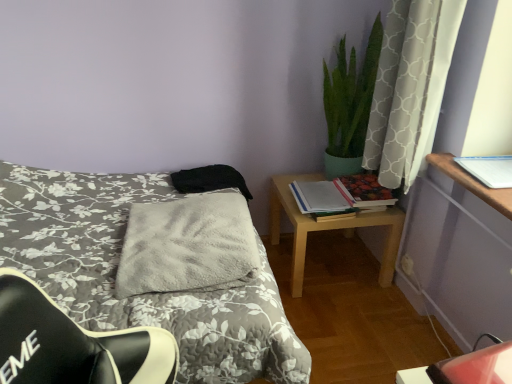
This screenshot has height=384, width=512. Identify the location of black fabric pillow at center. coord(209,180).

Identify the location of light wood/texture nightstand at right. (327, 228).

From a real-world perspective, between white textured curtain at upper right and white paper at upper right, arranged as the 1th book when viewed from the right, who is vertically lower?

white paper at upper right, arranged as the 1th book when viewed from the right, from a real-world perspective.

Identify the location of curtain that appears above the white paper at upper right, arranged as the 1th book when viewed from the right (from a real-world perspective). (410, 87).

Is white textured curtain at upper right facing towards white paper at upper right, which is the 1th book from front to back?

No.

Does white textured curtain at upper right appear on the right side of white paper at upper right, which is the 1th book from front to back?

In fact, white textured curtain at upper right is to the left of white paper at upper right, which is the 1th book from front to back.

Is hardcover book at right, positioned as the second book in left-to-right order, turned away from matte paper book at center right, positioned as the 3th book in right-to-left order?

That's not correct — hardcover book at right, positioned as the second book in left-to-right order, is not looking away from matte paper book at center right, positioned as the 3th book in right-to-left order.

From the image's perspective, between hardcover book at right, the first book in the back-to-front sequence, and matte paper book at center right, the second book in the back-to-front sequence, who is located below?

matte paper book at center right, the second book in the back-to-front sequence, is shown below in the image.

Who is shorter, hardcover book at right, which appears as the second book when viewed from the right, or matte paper book at center right, the second book in the back-to-front sequence?

Standing shorter between the two is matte paper book at center right, the second book in the back-to-front sequence.

Is matte paper book at center right, the 1th book when ordered from left to right, bigger or smaller than white paper at upper right, the 3th book positioned from the back?

Clearly, matte paper book at center right, the 1th book when ordered from left to right, is larger in size than white paper at upper right, the 3th book positioned from the back.

Which is correct: matte paper book at center right, the second book in the back-to-front sequence, is inside white paper at upper right, arranged as the 1th book when viewed from the right, or outside of it?

matte paper book at center right, the second book in the back-to-front sequence, lies outside white paper at upper right, arranged as the 1th book when viewed from the right.

Considering the relative sizes of matte paper book at center right, the second book from the front, and white paper at upper right, the 3th book positioned from the back, in the image provided, is matte paper book at center right, the second book from the front, wider than white paper at upper right, the 3th book positioned from the back,?

Yes.

Starting from the white paper at upper right, which is the 1th book from front to back, which book is the 2nd one to the left? Please provide its 2D coordinates.

[(318, 197)]

Considering the positions of objects black fabric pillow at center and fluffy gray blanket at center in the image provided, who is more to the right, black fabric pillow at center or fluffy gray blanket at center?

black fabric pillow at center is more to the right.

Who is taller, black fabric pillow at center or fluffy gray blanket at center?

fluffy gray blanket at center is taller.

Is black fabric pillow at center wider than fluffy gray blanket at center?

Incorrect, the width of black fabric pillow at center does not surpass that of fluffy gray blanket at center.

From the picture: From a real-world perspective, which object stands above the other?

black fabric pillow at center is physically above.

Who is more distant, black fabric pillow at center or matte paper book at center right, the second book in the back-to-front sequence?

black fabric pillow at center is behind.

Which is closer, [222,179] or [297,187]?

Point [222,179] is positioned closer to the camera compared to point [297,187].

Who is taller, black fabric pillow at center or matte paper book at center right, the second book from the front?

black fabric pillow at center is taller.

Is the depth of black fabric pillow at center greater than that of hardcover book at right, which appears as the second book when viewed from the right?

Yes, it is behind hardcover book at right, which appears as the second book when viewed from the right.

Between black fabric pillow at center and hardcover book at right, which appears as the second book when viewed from the right, which one appears on the left side from the viewer's perspective?

Positioned to the left is black fabric pillow at center.

Does black fabric pillow at center have a larger size compared to hardcover book at right, which appears as the second book when viewed from the right?

Yes, black fabric pillow at center is bigger than hardcover book at right, which appears as the second book when viewed from the right.

Is hardcover book at right, the first book in the back-to-front sequence, inside black fabric pillow at center?

No, hardcover book at right, the first book in the back-to-front sequence, is located outside of black fabric pillow at center.

Does point (192, 266) come farther from viewer compared to point (204, 183)?

No, it is not.

From the image's perspective, which one is positioned higher, gray fluffy blanket at center or black fabric pillow at center?

From the image's view, black fabric pillow at center is above.

Is black fabric pillow at center at the back of gray fluffy blanket at center?

gray fluffy blanket at center is not turned away from black fabric pillow at center.

Is gray fluffy blanket at center positioned in front of black fabric pillow at center?

Yes, it is.

From a real-world perspective, starting from the white textured curtain at upper right, which book is the 1st one below it? Please provide its 2D coordinates.

[(489, 169)]

Image resolution: width=512 pixels, height=384 pixels. Identify the location of book behind the matte paper book at center right, the 1th book when ordered from left to right. (364, 190).

Based on their spatial positions, is light wood/texture nightstand at right or fluffy gray blanket at center further from black fabric pillow at center?

fluffy gray blanket at center.

Considering their positions, is matte paper book at center right, the second book in the back-to-front sequence, positioned further to fluffy gray blanket at center than black fabric pillow at center?

matte paper book at center right, the second book in the back-to-front sequence, is further to fluffy gray blanket at center.

Which object lies further to the anchor point light wood/texture nightstand at right, fluffy gray blanket at center or hardcover book at right, placed as the third book when sorted from front to back?

Based on the image, fluffy gray blanket at center appears to be further to light wood/texture nightstand at right.

Based on their spatial positions, is matte paper book at center right, the second book in the back-to-front sequence, or black fabric pillow at center closer to white textured curtain at upper right?

The object closer to white textured curtain at upper right is matte paper book at center right, the second book in the back-to-front sequence.

Which object lies further to the anchor point fluffy gray blanket at center, hardcover book at right, placed as the third book when sorted from front to back, or black fabric pillow at center?

hardcover book at right, placed as the third book when sorted from front to back, is further to fluffy gray blanket at center.

Which object lies nearer to the anchor point white paper at upper right, arranged as the 1th book when viewed from the right, fluffy gray blanket at center or hardcover book at right, the first book in the back-to-front sequence?

The object closer to white paper at upper right, arranged as the 1th book when viewed from the right, is hardcover book at right, the first book in the back-to-front sequence.

Estimate the real-world distances between objects in this image. Which object is closer to fluffy gray blanket at center, hardcover book at right, placed as the third book when sorted from front to back, or white textured curtain at upper right?

white textured curtain at upper right is closer to fluffy gray blanket at center.

Considering their positions, is hardcover book at right, positioned as the second book in left-to-right order, positioned further to matte paper book at center right, the second book from the front, than white paper at upper right, which appears as the third book when viewed from the left?

white paper at upper right, which appears as the third book when viewed from the left, is further to matte paper book at center right, the second book from the front.

This screenshot has height=384, width=512. Identify the location of pillow between gray fluffy blanket at center and light wood/texture nightstand at right. (209, 180).

You are a GUI agent. You are given a task and a screenshot of the screen. Output one action in this format:
    pyautogui.click(x=<x>, y=<y>)
    Task: Click on the nightstand between fluffy gray blanket at center and white paper at upper right, the 3th book positioned from the back, in the horizontal direction
    
    Given the screenshot: What is the action you would take?
    pyautogui.click(x=327, y=228)

Locate an element on the screen. Image resolution: width=512 pixels, height=384 pixels. nightstand between white paper at upper right, which appears as the third book when viewed from the left, and hardcover book at right, the first book in the back-to-front sequence, from front to back is located at coordinates (327, 228).

Identify the location of book located between black fabric pillow at center and light wood/texture nightstand at right in the left-right direction. (318, 197).